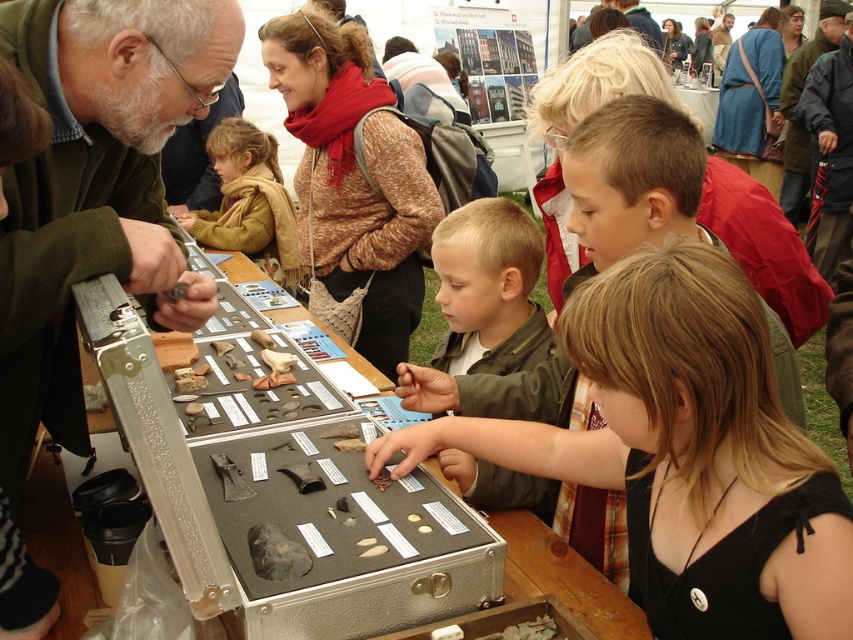
Which of these two, blonde hair at center or brown woolen scarf at upper center, stands shorter?

Standing shorter between the two is blonde hair at center.

Describe the element at coordinates (631, 180) in the screenshot. I see `blonde hair at center` at that location.

Find the location of a particular element. The height and width of the screenshot is (640, 853). blonde hair at center is located at coordinates (631, 180).

Can you confirm if green matte jacket at upper left is positioned to the right of green matte jacket at center?

Incorrect, green matte jacket at upper left is not on the right side of green matte jacket at center.

Does green matte jacket at upper left appear over green matte jacket at center?

Yes, green matte jacket at upper left is above green matte jacket at center.

Locate an element on the screen. The height and width of the screenshot is (640, 853). green matte jacket at upper left is located at coordinates (96, 189).

Is green matte jacket at upper left shorter than brown fuzzy jacket at upper left?

Yes.

Between point (143, 260) and point (276, 227), which one is positioned behind?

The point (276, 227) is behind.

This screenshot has height=640, width=853. I want to click on green matte jacket at upper left, so (96, 189).